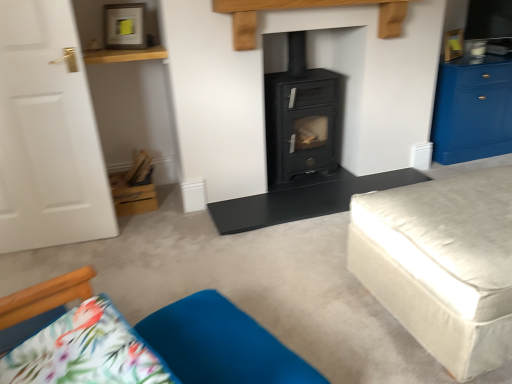
You are a GUI agent. You are given a task and a screenshot of the screen. Output one action in this format:
    pyautogui.click(x=<x>, y=<y>)
    Task: Click on the vacant area that lies to the right of velvety blue cushion at lower center
    The width and height of the screenshot is (512, 384).
    Given the screenshot: What is the action you would take?
    pyautogui.click(x=357, y=342)